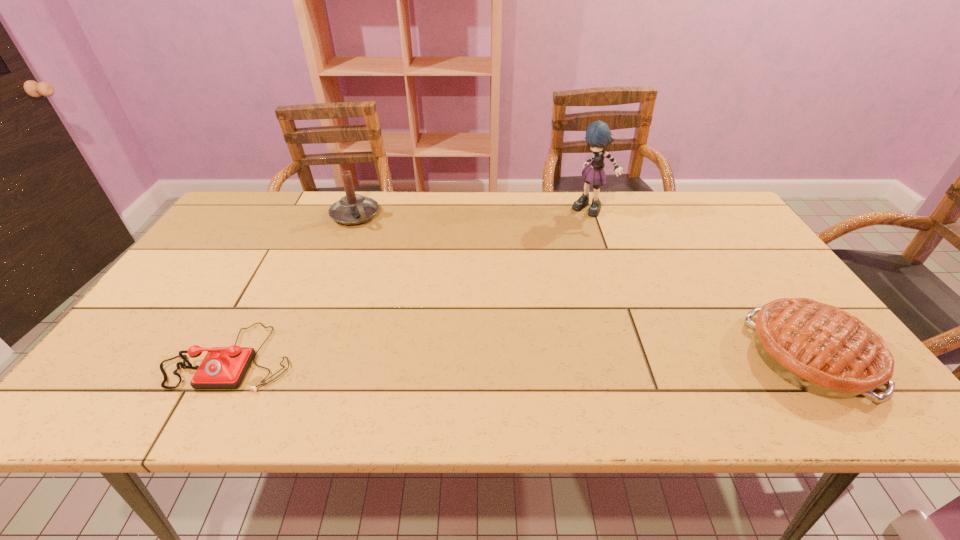
Locate an element on the screen. free space on the desktop that is between the shortest object and the second shortest object and is positioned on the side of the third shortest object with the handle loop is located at coordinates (455, 356).

This screenshot has width=960, height=540. In order to click on vacant space on the desktop that is between the shortest object and the third tallest object and is positioned on the front-facing side of the tallest object in this screenshot , I will do `click(507, 356)`.